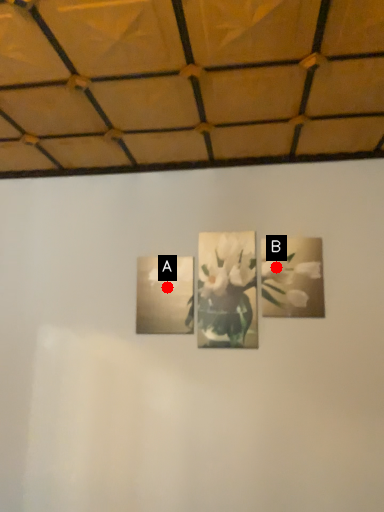
Question: Two points are circled on the image, labeled by A and B beside each circle. Among these points, which one is farthest from the camera?

Choices:
 (A) A is further
 (B) B is further

Answer: (A)